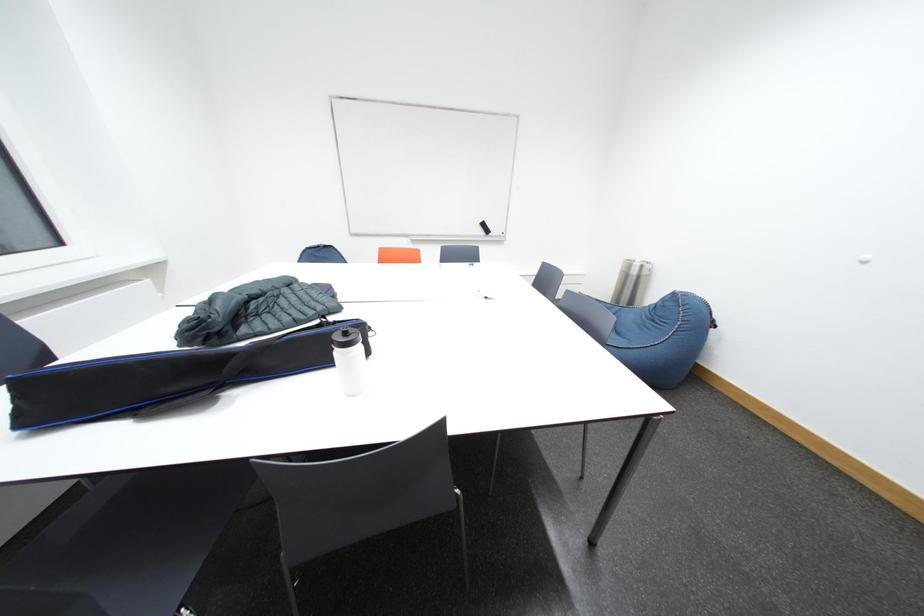
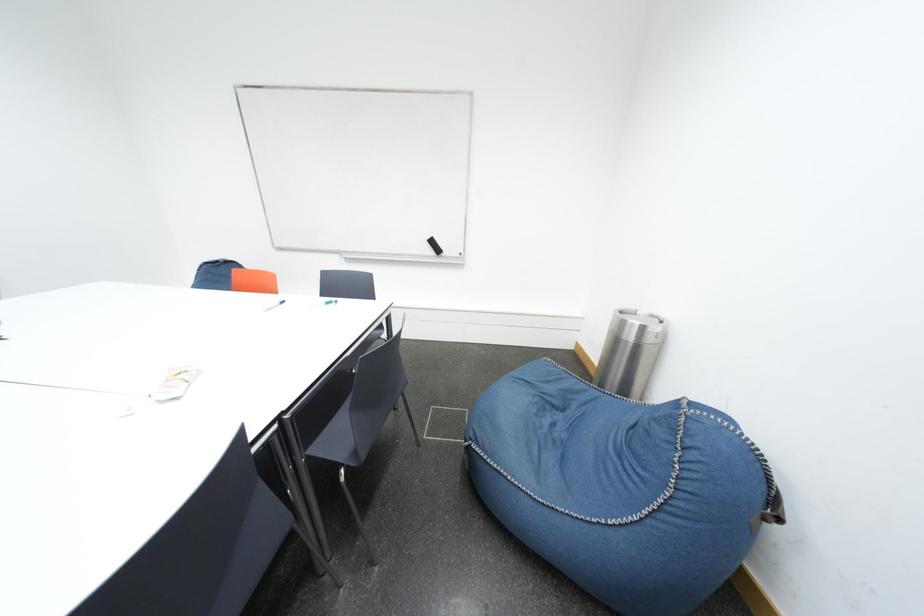
The images are taken continuously from a first-person perspective. In which direction are you moving?

The movement direction of the cameraman is right, forward.